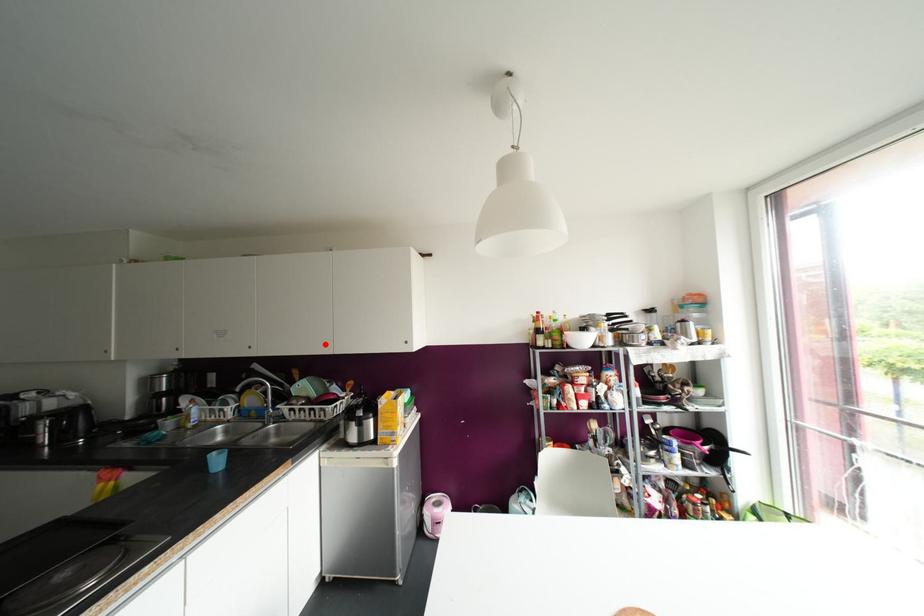
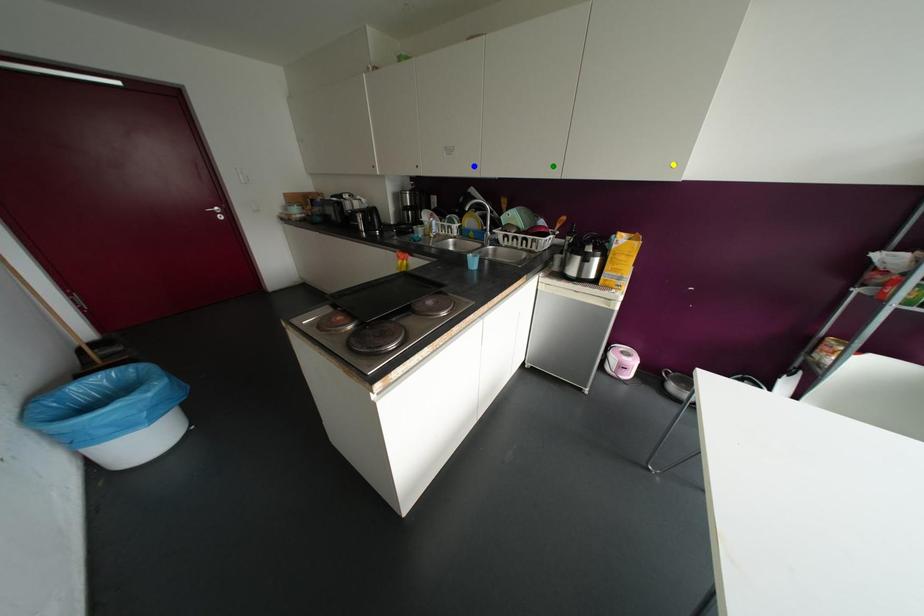
Question: I am providing you with two images of the same scene from different viewpoints. A red point is marked on the first image. You are given multiple points on the second image. Can you choose the point in image 2 that corresponds to the point in image 1?

Choices:
 (A) green point
 (B) yellow point
 (C) blue point

Answer: (A)